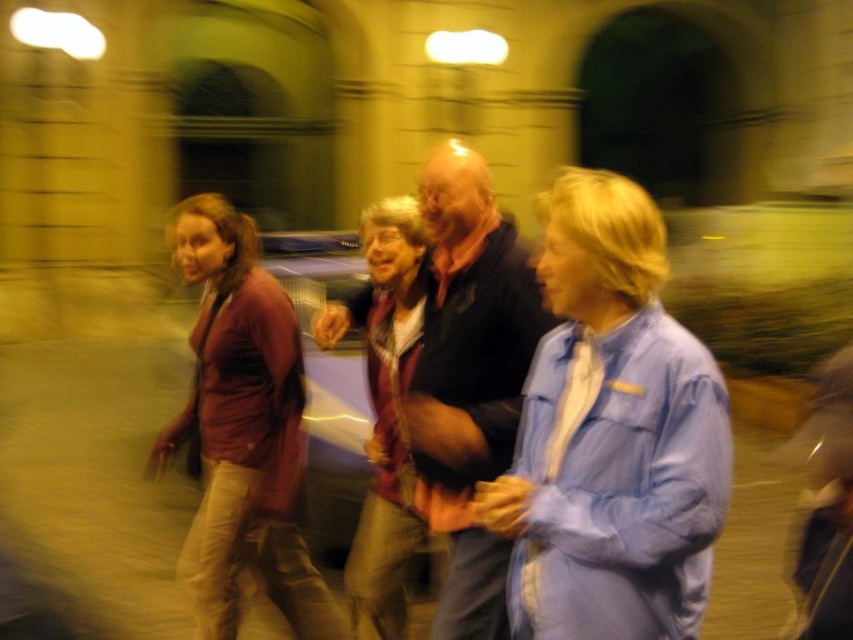
You are a photographer trying to capture a clear photo of the dark blue shirt at center and the matte red jacket at center. The camera has a focus range of 18 inches. Can you focus on both subjects simultaneously?

The distance between the dark blue shirt at center and matte red jacket at center is 19.37 inches. Since the camera can only focus within an 18 inch range, the two subjects are too far apart for the camera to focus on both at the same time.